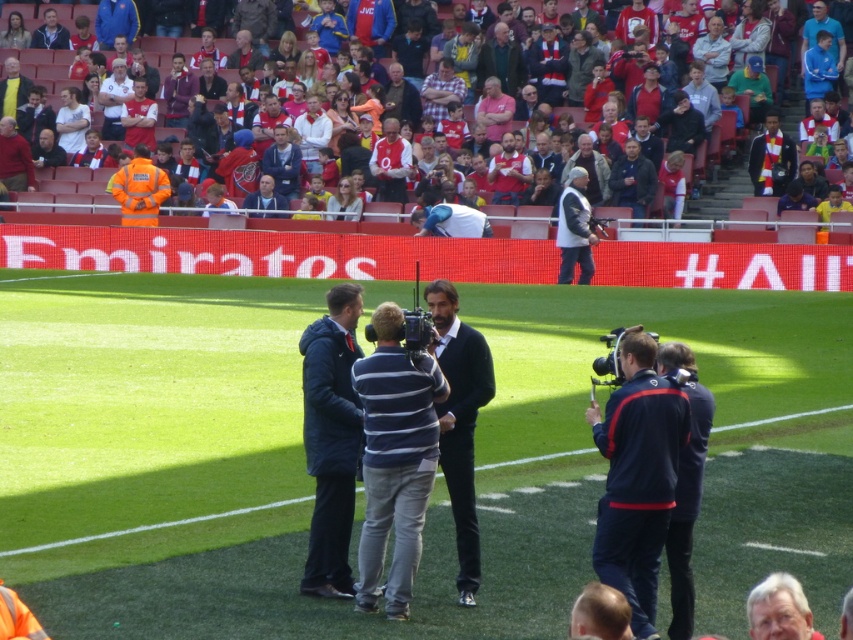
The image size is (853, 640). What do you see at coordinates (721, 188) in the screenshot? I see `red fabric seats at upper center` at bounding box center [721, 188].

Between red fabric seats at upper center and white fabric shirt at center, which one has more height?

red fabric seats at upper center is taller.

This screenshot has height=640, width=853. Identify the location of red fabric seats at upper center. (721, 188).

Between gray hair at lower right and dark gray leather jacket at center, which one has less height?

With less height is gray hair at lower right.

Who is positioned more to the left, gray hair at lower right or dark gray leather jacket at center?

gray hair at lower right is more to the left.

Which is behind, point (805, 628) or point (572, 221)?

The point (572, 221) is more distant.

Image resolution: width=853 pixels, height=640 pixels. In order to click on gray hair at lower right in this screenshot , I will do pos(779,609).

Is dark blue fabric jacket at right thinner than gray hair at lower right?

In fact, dark blue fabric jacket at right might be wider than gray hair at lower right.

Between dark blue fabric jacket at right and gray hair at lower right, which one is positioned lower?

gray hair at lower right is below.

Consider the image. Who is more forward, (x=606, y=504) or (x=751, y=632)?

Point (x=751, y=632) is in front.

The image size is (853, 640). I want to click on dark blue fabric jacket at right, so coord(637,476).